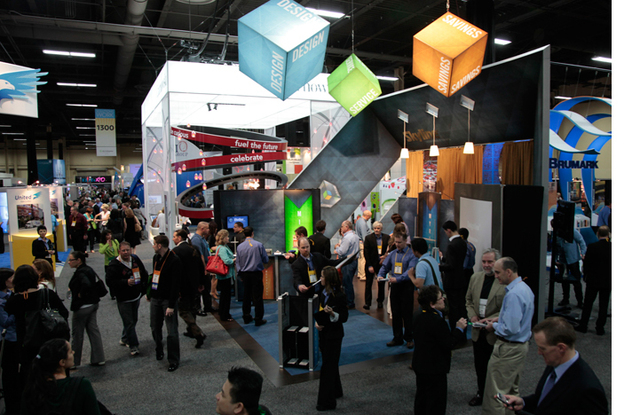
Where is `lights`? This screenshot has width=640, height=415. lights is located at coordinates (68, 51), (77, 76), (81, 97), (608, 61), (557, 49).